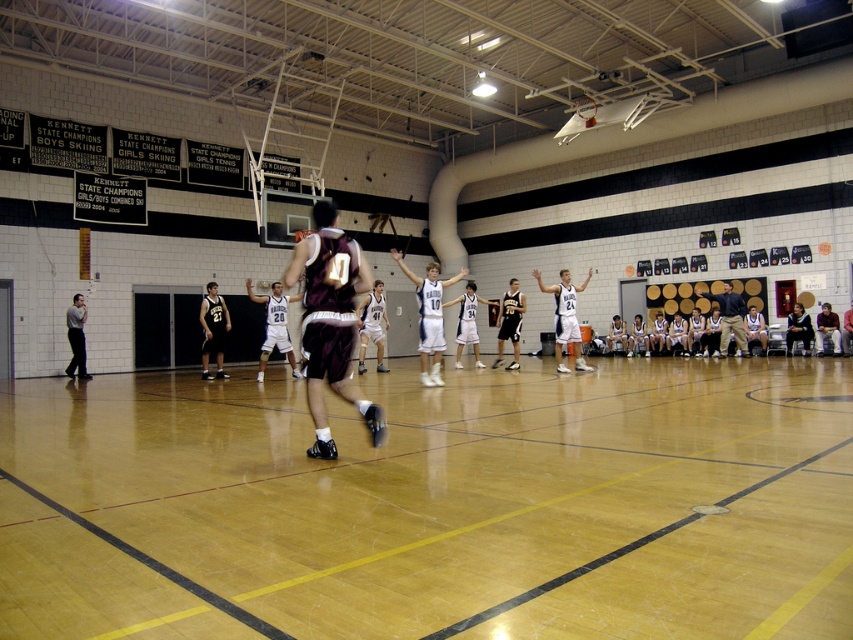
Between maroon jersey at center and dark blue shirt at right, which one appears on the left side from the viewer's perspective?

maroon jersey at center is more to the left.

Which is more to the right, maroon jersey at center or dark blue shirt at right?

dark blue shirt at right is more to the right.

Where is `maroon jersey at center`? maroon jersey at center is located at coordinates (329, 323).

Locate an element on the screen. maroon jersey at center is located at coordinates (329, 323).

Does point (560, 342) lie behind point (204, 362)?

No.

At what (x,y) coordinates should I click in order to perform the action: click on white jersey at center. Please return your answer as a coordinate pair (x, y). Looking at the image, I should click on (566, 317).

Between wooden floor at center and matte black jersey at center, which one has less height?

wooden floor at center is shorter.

Where is `wooden floor at center`? wooden floor at center is located at coordinates pyautogui.click(x=434, y=506).

Who is more distant from viewer, (x=114, y=493) or (x=213, y=282)?

The point (x=213, y=282) is behind.

This screenshot has width=853, height=640. What are the coordinates of `wooden floor at center` in the screenshot? It's located at (434, 506).